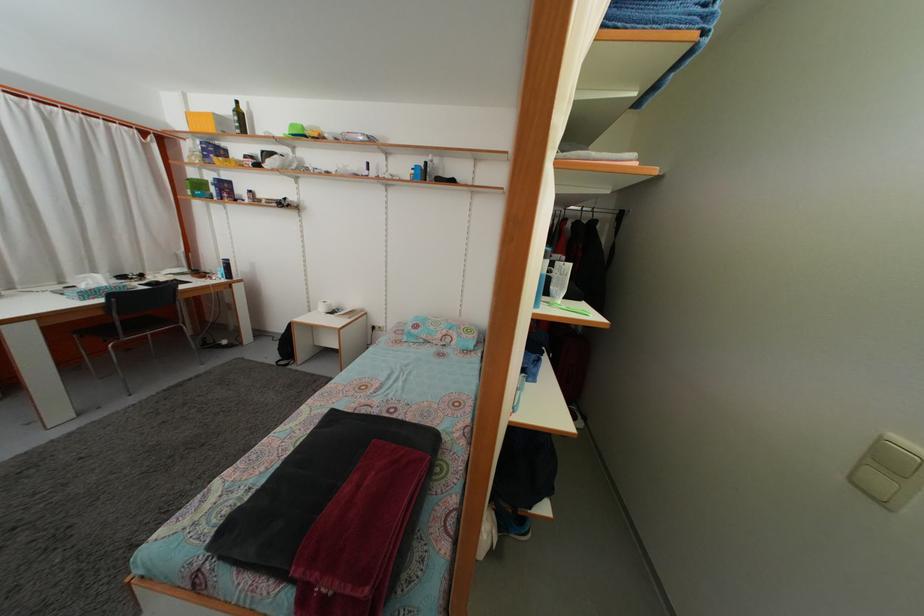
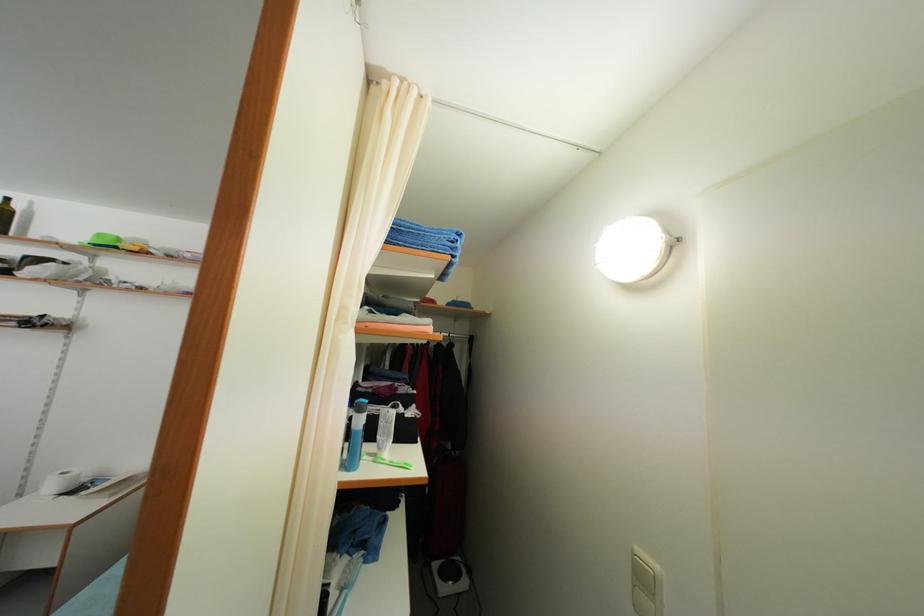
The point at (553, 310) is marked in the first image. Where is the corresponding point in the second image?

(381, 463)